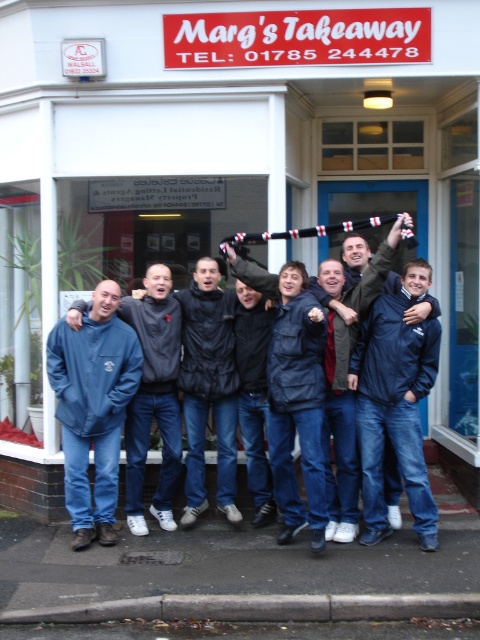
In the scene shown: Who is more distant from viewer, (398,403) or (262,275)?

Positioned behind is point (262,275).

Does point (377, 500) lie in front of point (345, 326)?

Yes, it is in front of point (345, 326).

What are the coordinates of `navy blue jacket at center` in the screenshot? It's located at (395, 403).

Does navy blue jacket at center appear over blue fleece jacket at center?

Indeed, navy blue jacket at center is positioned over blue fleece jacket at center.

How much distance is there between navy blue jacket at center and blue fleece jacket at center?

They are 5.43 feet apart.

Is point (427, 509) in front of point (145, 269)?

Yes, it is.

Identify the location of navy blue jacket at center. (395, 403).

Is blue fleece jacket at center closer to the viewer compared to dark blue jacket at center?

No, blue fleece jacket at center is behind dark blue jacket at center.

Between blue fleece jacket at center and dark blue jacket at center, which one has less height?

With less height is blue fleece jacket at center.

Who is more distant from viewer, (x=145, y=458) or (x=343, y=332)?

The point (x=145, y=458) is behind.

In order to click on blue fleece jacket at center in this screenshot , I will do `click(154, 397)`.